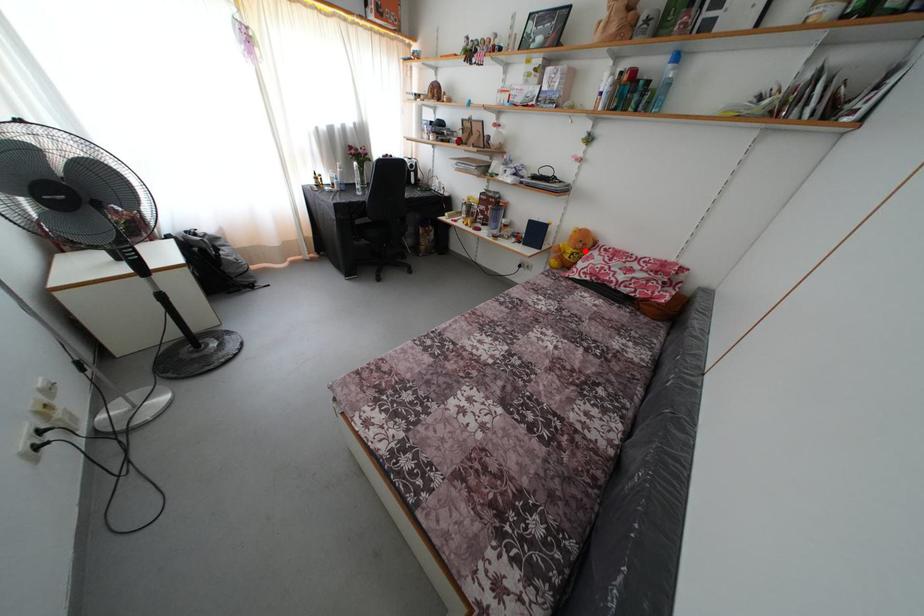
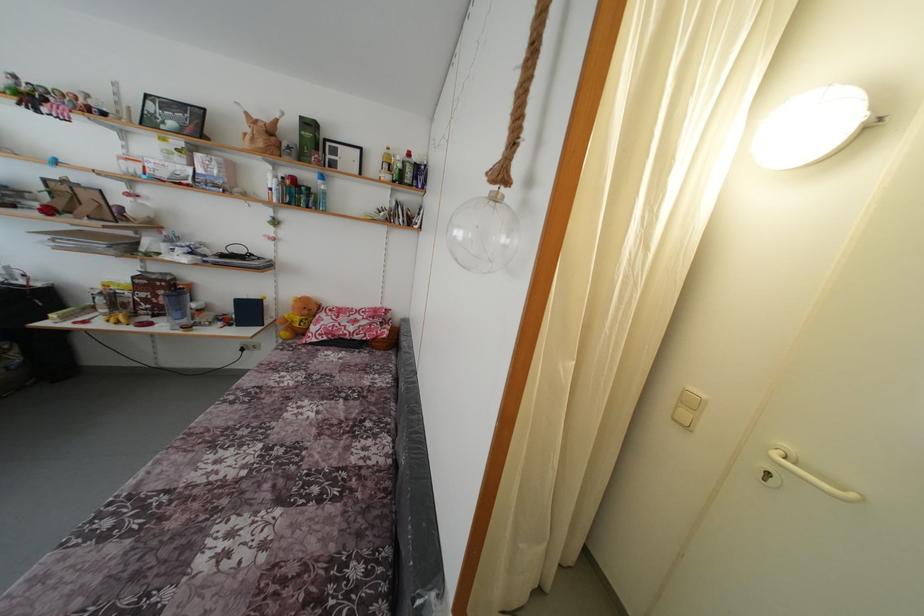
The point at the highlighted location is marked in the first image. Where is the corresponding point in the second image?

(310, 317)